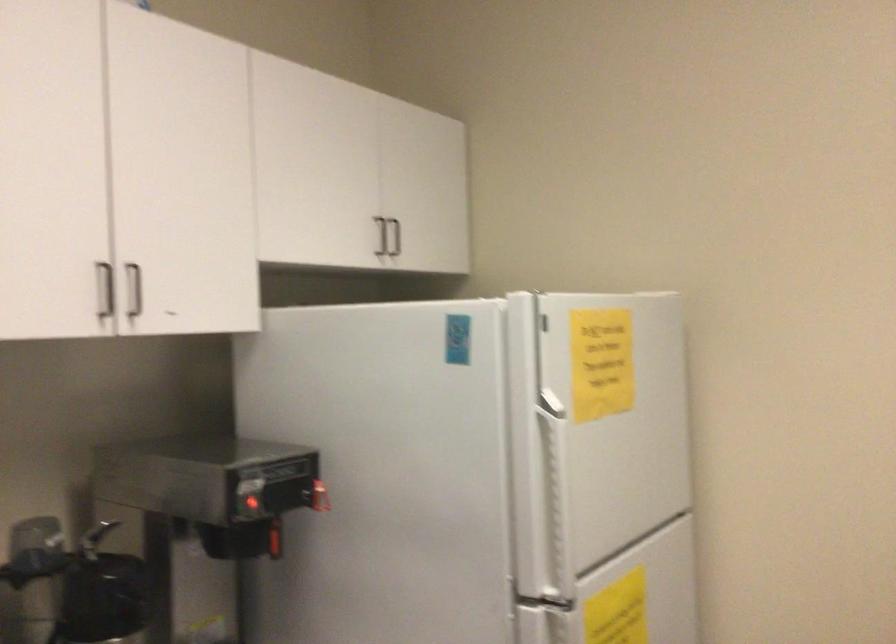
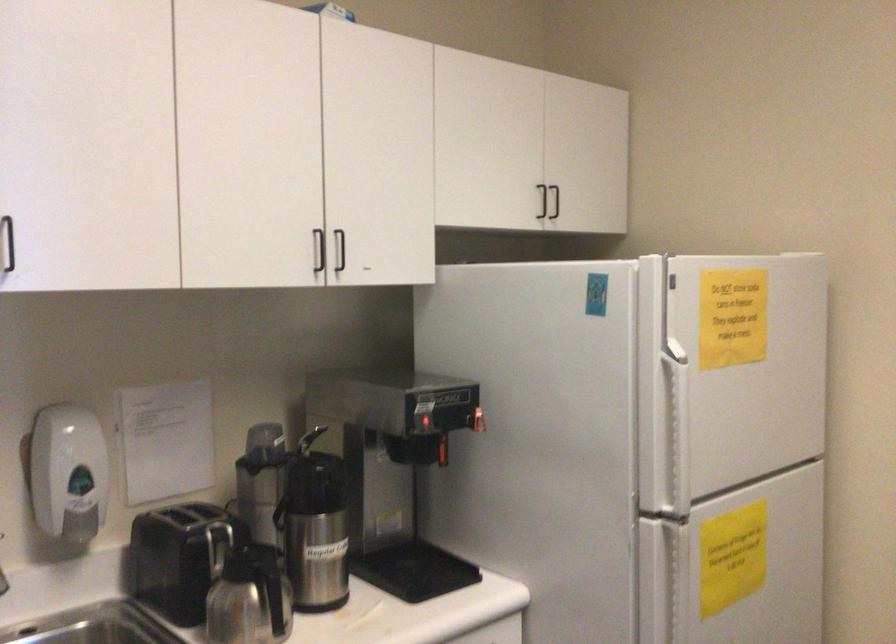
The point at (274, 534) is marked in the first image. Where is the corresponding point in the second image?

(442, 451)